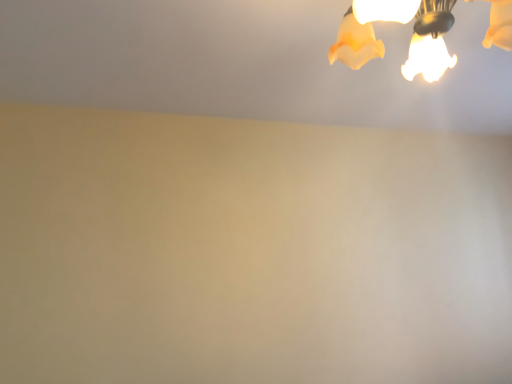
Find the location of a particular element. The image size is (512, 384). matte yellow lampshade at upper right is located at coordinates (399, 22).

The width and height of the screenshot is (512, 384). What do you see at coordinates (399, 22) in the screenshot?
I see `matte yellow lampshade at upper right` at bounding box center [399, 22].

Identify the location of matte yellow lampshade at upper right. Image resolution: width=512 pixels, height=384 pixels. (399, 22).